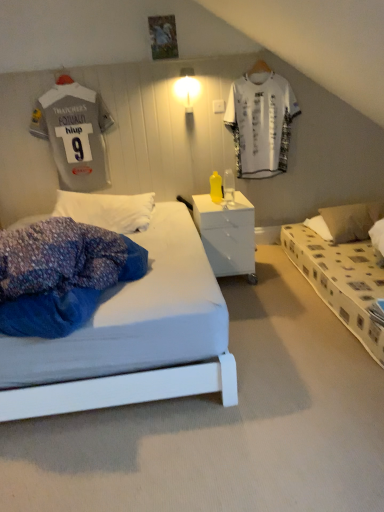
What is the approximate width of white glossy light fixture at upper center?

It is 6.12 inches.

Describe the element at coordinates (261, 121) in the screenshot. I see `white printed t-shirt at upper center, the 2th t shirt positioned from the left` at that location.

The height and width of the screenshot is (512, 384). I want to click on gray jersey at upper left, arranged as the 1th t shirt when viewed from the left, so click(77, 134).

At what (x,y) coordinates should I click in order to perform the action: click on brown fabric pillow at right. Please return your answer as a coordinate pair (x, y). The image size is (384, 512). Looking at the image, I should click on (351, 220).

The image size is (384, 512). What do you see at coordinates (227, 234) in the screenshot?
I see `white plastic nightstand at center` at bounding box center [227, 234].

The height and width of the screenshot is (512, 384). What do you see at coordinates (229, 187) in the screenshot? I see `yellow plastic bottle at center` at bounding box center [229, 187].

Where is `white glossy light fixture at upper center`? This screenshot has height=512, width=384. white glossy light fixture at upper center is located at coordinates (187, 88).

From a real-world perspective, count 1st t shirts upward from the white plastic nightstand at center and point to it. Please provide its 2D coordinates.

[(261, 121)]

Can you confirm if white printed t-shirt at upper center, the 2th t shirt positioned from the left, is positioned to the left of white plastic nightstand at center?

No, white printed t-shirt at upper center, the 2th t shirt positioned from the left, is not to the left of white plastic nightstand at center.

Is white printed t-shirt at upper center, which is counted as the 1th t shirt, starting from the right, wider or thinner than white plastic nightstand at center?

In the image, white printed t-shirt at upper center, which is counted as the 1th t shirt, starting from the right, appears to be more narrow than white plastic nightstand at center.

How far apart are white printed t-shirt at upper center, which is counted as the 1th t shirt, starting from the right, and white plastic nightstand at center?

white printed t-shirt at upper center, which is counted as the 1th t shirt, starting from the right, and white plastic nightstand at center are 86.52 centimeters apart.

Based on their sizes in the image, would you say brown fabric pillow at right is bigger or smaller than gray jersey at upper left, which appears as the 2th t shirt when viewed from the right?

brown fabric pillow at right is smaller than gray jersey at upper left, which appears as the 2th t shirt when viewed from the right.

From a real-world perspective, is brown fabric pillow at right beneath gray jersey at upper left, arranged as the 1th t shirt when viewed from the left?

Yes, from a real-world perspective, brown fabric pillow at right is under gray jersey at upper left, arranged as the 1th t shirt when viewed from the left.

Is point (362, 220) farther from camera compared to point (82, 151)?

No, (362, 220) is closer to viewer.

There is a brown fabric pillow at right. Where is `the 2nd t shirt above it (from a real-world perspective)`? The height and width of the screenshot is (512, 384). the 2nd t shirt above it (from a real-world perspective) is located at coordinates (77, 134).

Which is more to the left, white printed t-shirt at upper center, the 2th t shirt positioned from the left, or white glossy light fixture at upper center?

white glossy light fixture at upper center.

Is white printed t-shirt at upper center, the 2th t shirt positioned from the left, next to white glossy light fixture at upper center and touching it?

No, white printed t-shirt at upper center, the 2th t shirt positioned from the left, is not in contact with white glossy light fixture at upper center.

Is white printed t-shirt at upper center, the 2th t shirt positioned from the left, oriented towards white glossy light fixture at upper center?

No, white printed t-shirt at upper center, the 2th t shirt positioned from the left, is not facing towards white glossy light fixture at upper center.

Is white printed t-shirt at upper center, which is counted as the 1th t shirt, starting from the right, wider than white glossy light fixture at upper center?

No.

Is point (233, 181) closer or farther from the camera than point (356, 211)?

Point (233, 181) is farther from the camera than point (356, 211).

From a real-world perspective, who is located higher, yellow plastic bottle at center or brown fabric pillow at right?

From a 3D spatial view, yellow plastic bottle at center is above.

Could you tell me if yellow plastic bottle at center is facing brown fabric pillow at right?

No, yellow plastic bottle at center is not aimed at brown fabric pillow at right.

Is brown fabric pillow at right aimed at white plastic nightstand at center?

No, brown fabric pillow at right is not aimed at white plastic nightstand at center.

In the scene shown: Which object is more forward, brown fabric pillow at right or white plastic nightstand at center?

white plastic nightstand at center is closer to the camera.

Considering the sizes of brown fabric pillow at right and white plastic nightstand at center in the image, is brown fabric pillow at right taller or shorter than white plastic nightstand at center?

Considering their sizes, brown fabric pillow at right has less height than white plastic nightstand at center.

Looking at this image, measure the distance between white glossy light fixture at upper center and brown fabric pillow at right.

A distance of 1.47 meters exists between white glossy light fixture at upper center and brown fabric pillow at right.

Does white glossy light fixture at upper center have a larger size compared to brown fabric pillow at right?

No.

Considering the relative positions of white glossy light fixture at upper center and brown fabric pillow at right in the image provided, is white glossy light fixture at upper center to the left of brown fabric pillow at right from the viewer's perspective?

Indeed, white glossy light fixture at upper center is positioned on the left side of brown fabric pillow at right.

From the image's perspective, is white glossy light fixture at upper center on brown fabric pillow at right?

Yes, from the image's perspective, white glossy light fixture at upper center is over brown fabric pillow at right.

Between point (363, 203) and point (190, 70), which one is positioned in front?

Point (190, 70)

Considering the positions of objects brown fabric pillow at right and white glossy light fixture at upper center in the image provided, who is more to the right, brown fabric pillow at right or white glossy light fixture at upper center?

Positioned to the right is brown fabric pillow at right.

From the picture: Is brown fabric pillow at right placed right next to white glossy light fixture at upper center?

No.

What's the angular difference between brown fabric pillow at right and white glossy light fixture at upper center's facing directions?

0.986 degrees separate the facing orientations of brown fabric pillow at right and white glossy light fixture at upper center.

Where is `the 2nd t shirt above when counting from the white plastic nightstand at center (from the image's perspective)`? the 2nd t shirt above when counting from the white plastic nightstand at center (from the image's perspective) is located at coordinates (261, 121).

I want to click on pillow located below the gray jersey at upper left, arranged as the 1th t shirt when viewed from the left (from the image's perspective), so click(351, 220).

Estimate the real-world distances between objects in this image. Which object is closer to white printed t-shirt at upper center, the 2th t shirt positioned from the left, brown fabric pillow at right or yellow plastic bottle at center?

yellow plastic bottle at center is closer to white printed t-shirt at upper center, the 2th t shirt positioned from the left.

When comparing their distances from brown fabric pillow at right, does white plastic nightstand at center or white glossy light fixture at upper center seem closer?

white plastic nightstand at center is closer to brown fabric pillow at right.

In the scene shown: Estimate the real-world distances between objects in this image. Which object is closer to brown fabric pillow at right, white plastic nightstand at center or yellow plastic bottle at center?

white plastic nightstand at center lies closer to brown fabric pillow at right than the other object.

From the image, which object appears to be nearer to white glossy light fixture at upper center, yellow plastic bottle at center or white plastic nightstand at center?

Among the two, yellow plastic bottle at center is located nearer to white glossy light fixture at upper center.

When comparing their distances from white plastic nightstand at center, does white glossy light fixture at upper center or white printed t-shirt at upper center, which is counted as the 1th t shirt, starting from the right, seem closer?

Based on the image, white printed t-shirt at upper center, which is counted as the 1th t shirt, starting from the right, appears to be nearer to white plastic nightstand at center.

Which object lies nearer to the anchor point brown fabric pillow at right, gray jersey at upper left, arranged as the 1th t shirt when viewed from the left, or white glossy light fixture at upper center?

Among the two, white glossy light fixture at upper center is located nearer to brown fabric pillow at right.

Based on their spatial positions, is brown fabric pillow at right or white glossy light fixture at upper center further from white printed t-shirt at upper center, the 2th t shirt positioned from the left?

Among the two, brown fabric pillow at right is located further to white printed t-shirt at upper center, the 2th t shirt positioned from the left.

From the image, which object appears to be nearer to white printed t-shirt at upper center, the 2th t shirt positioned from the left, gray jersey at upper left, which appears as the 2th t shirt when viewed from the right, or yellow plastic bottle at center?

yellow plastic bottle at center lies closer to white printed t-shirt at upper center, the 2th t shirt positioned from the left, than the other object.

Image resolution: width=384 pixels, height=512 pixels. I want to click on t shirt between white glossy light fixture at upper center and brown fabric pillow at right in the horizontal direction, so click(x=261, y=121).

The image size is (384, 512). I want to click on nightstand located between white glossy light fixture at upper center and brown fabric pillow at right in the left-right direction, so click(x=227, y=234).

What are the coordinates of `table lamp between gray jersey at upper left, which appears as the 2th t shirt when viewed from the right, and white printed t-shirt at upper center, which is counted as the 1th t shirt, starting from the right` in the screenshot? It's located at (229, 187).

Locate an element on the screen. The width and height of the screenshot is (384, 512). nightstand situated between gray jersey at upper left, which appears as the 2th t shirt when viewed from the right, and yellow plastic bottle at center from left to right is located at coordinates (227, 234).